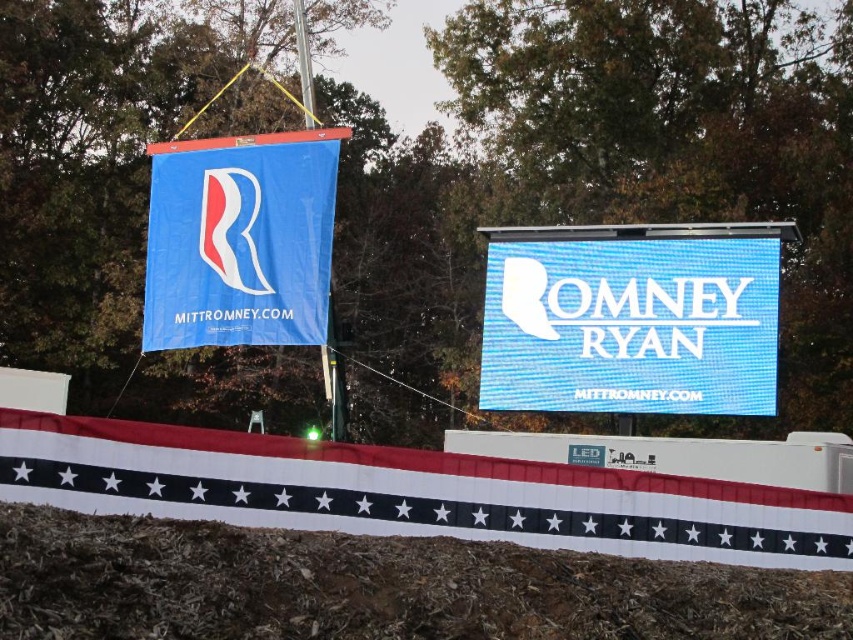
You are standing at the base of the dirt mound in the foreground of the image. You see a point marked at coordinates point (412, 492). What object is located at that point?

The point (412, 492) marks the white fabric banner at lower center.

Based on the scene description, which banner, the white fabric banner at lower center or the blue fabric banner at upper left, is wider?

The white fabric banner at lower center might be wider than the blue fabric banner at upper left.